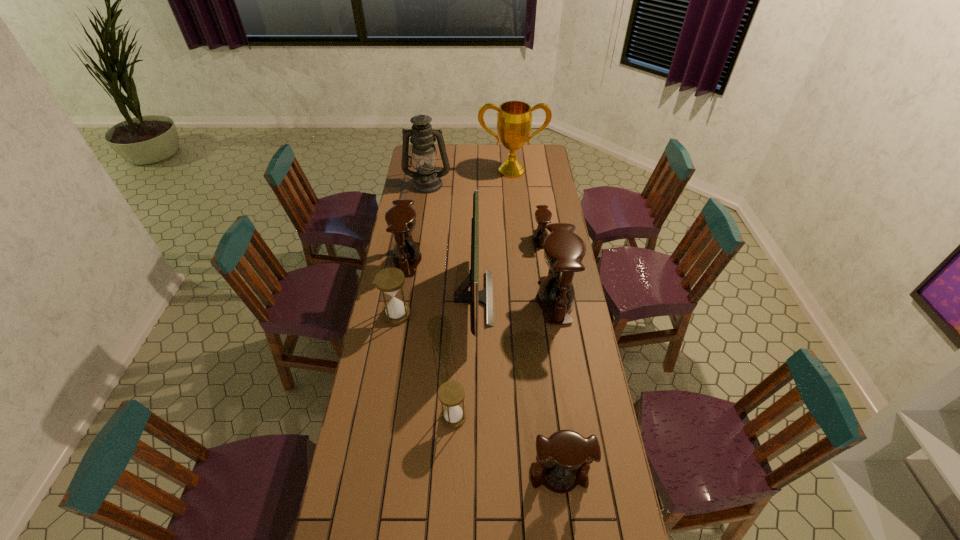
Image resolution: width=960 pixels, height=540 pixels. Find the location of `award`. award is located at coordinates (514, 118).

Find the location of a particular element. The image size is (960, 540). oil lamp is located at coordinates (426, 179).

You are a GUI agent. You are given a task and a screenshot of the screen. Output one action in this format:
    pyautogui.click(x=<x>, y=<y>)
    Task: Click on the monitor
    
    Given the screenshot: What is the action you would take?
    pyautogui.click(x=461, y=295)

Find the location of a particular element. The height and width of the screenshot is (540, 960). the tallest hourglass is located at coordinates [x=564, y=250].

Where is `the second nearest brown hourglass`? the second nearest brown hourglass is located at coordinates (564, 250).

Where is `the fifth shortest object`? the fifth shortest object is located at coordinates (401, 218).

You are a GUI agent. You are given a task and a screenshot of the screen. Output one action in this format:
    pyautogui.click(x=<x>, y=<y>)
    Task: Click on the fifth shortest hourglass
    The height and width of the screenshot is (540, 960).
    Given the screenshot: What is the action you would take?
    pyautogui.click(x=401, y=218)

At what (x,y) coordinates should I click in order to perform the action: click on the left white hourglass. Please return your answer as a coordinate pair (x, y). Image resolution: width=960 pixels, height=540 pixels. Looking at the image, I should click on (389, 280).

At what (x,y) coordinates should I click in order to perform the action: click on the bigger white hourglass. Please return your answer as a coordinate pair (x, y). This screenshot has height=540, width=960. Looking at the image, I should click on (389, 280).

This screenshot has height=540, width=960. I want to click on the nearest brown hourglass, so click(569, 455).